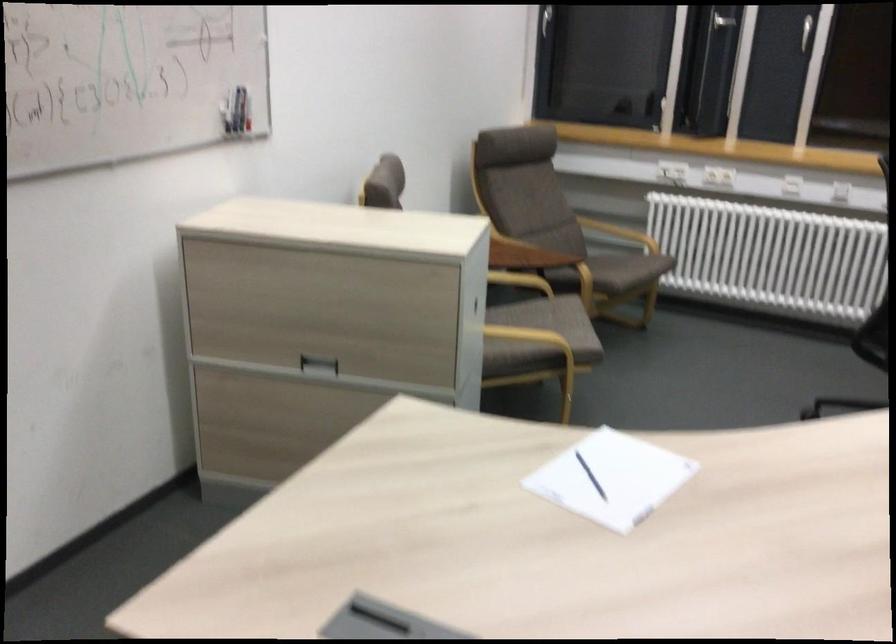
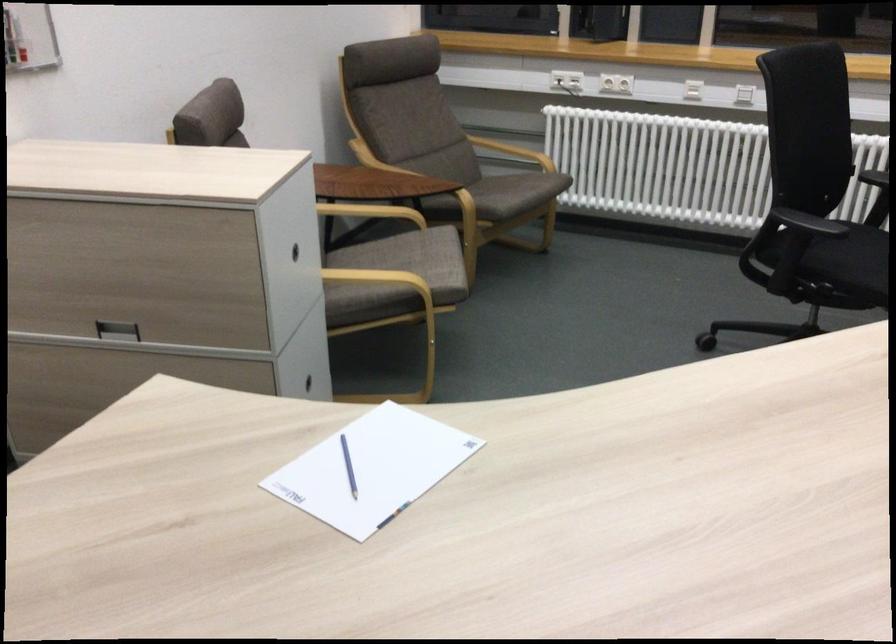
Locate, in the second image, the point that corresponds to (506,275) in the first image.

(371, 212)